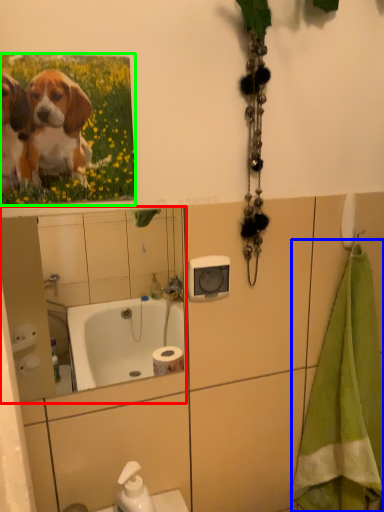
Question: Considering the real-world distances, which object is farthest from mirror (highlighted by a red box)? bath towel (highlighted by a blue box) or flower (highlighted by a green box)?

Choices:
 (A) bath towel
 (B) flower

Answer: (B)